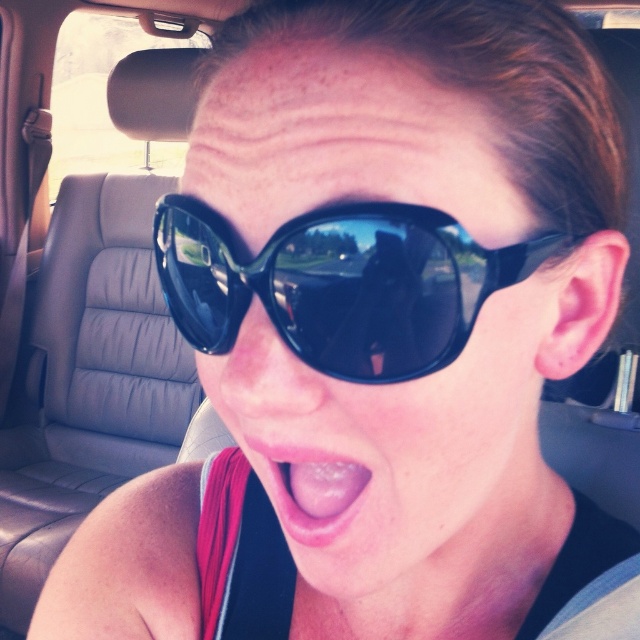
Question: Which point is farther to the camera?

Choices:
 (A) (435, 360)
 (B) (433, 378)
 (C) (292, 493)

Answer: (C)

Question: Which point is farther from the camera taking this photo?

Choices:
 (A) (448, 524)
 (B) (301, 333)

Answer: (A)

Question: Does black plastic sunglasses at center appear on the right side of pink flesh at center?

Choices:
 (A) no
 (B) yes

Answer: (B)

Question: Which point is closer to the camera?

Choices:
 (A) pink flesh at center
 (B) black plastic sunglasses at center

Answer: (B)

Question: Does black plastic sunglasses at center lie in front of black glossy sunglasses at center?

Choices:
 (A) yes
 (B) no

Answer: (B)

Question: Is black glossy sunglasses at center further to camera compared to pink flesh at center?

Choices:
 (A) yes
 (B) no

Answer: (B)